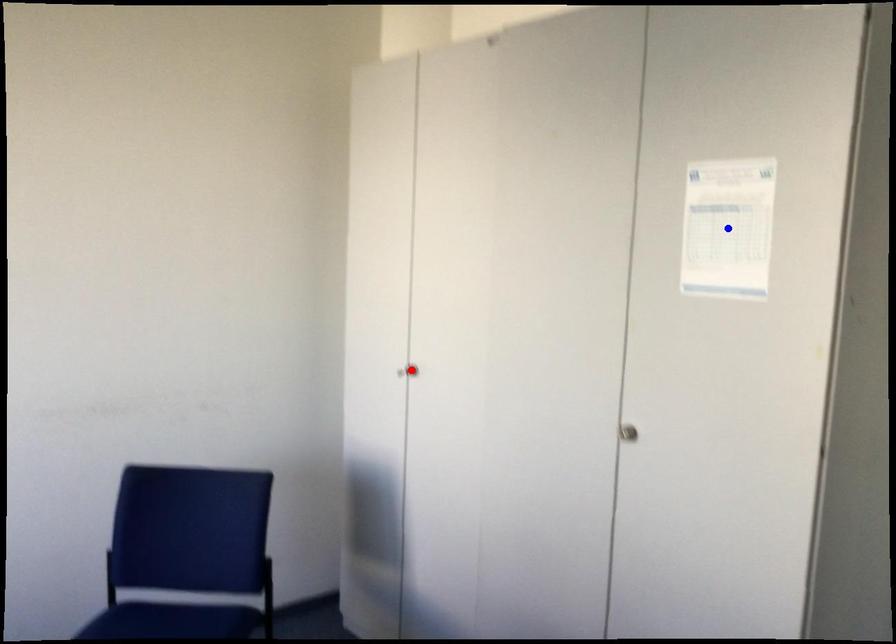
Question: Two points are marked on the image. Which point is closer to the camera?

Choices:
 (A) Blue point is closer.
 (B) Red point is closer.

Answer: (A)